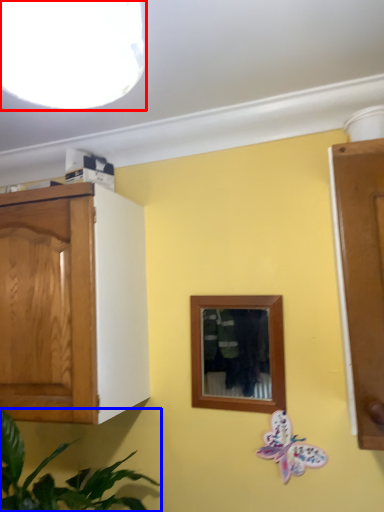
Question: Which object appears closest to the camera in this image, light fixture (highlighted by a red box) or houseplant (highlighted by a blue box)?

Choices:
 (A) light fixture
 (B) houseplant

Answer: (A)